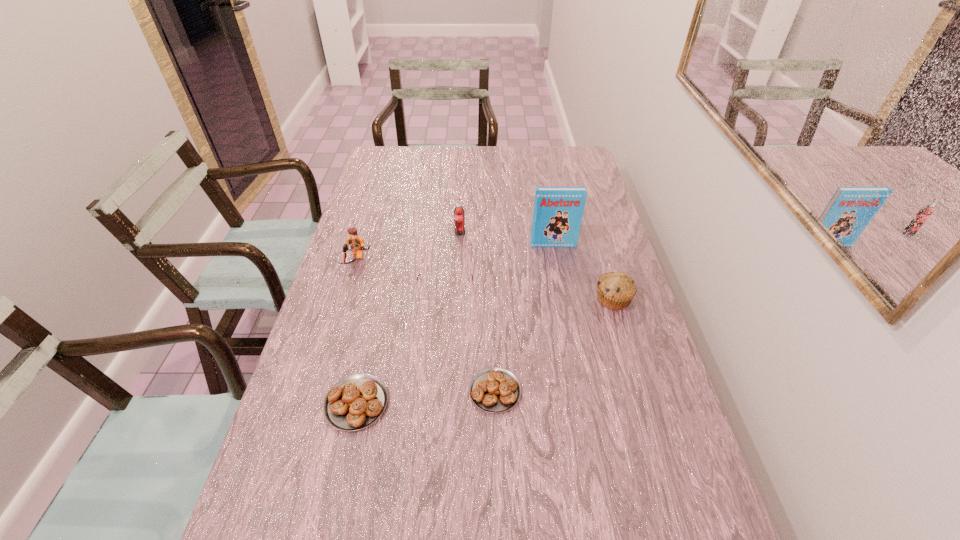
Please point a free position for a pastry on the right. Please provide its 2D coordinates. Your answer should be formatted as a tuple, i.e. [(x, y)], where the tuple contains the x and y coordinates of a point satisfying the conditions above.

[(628, 380)]